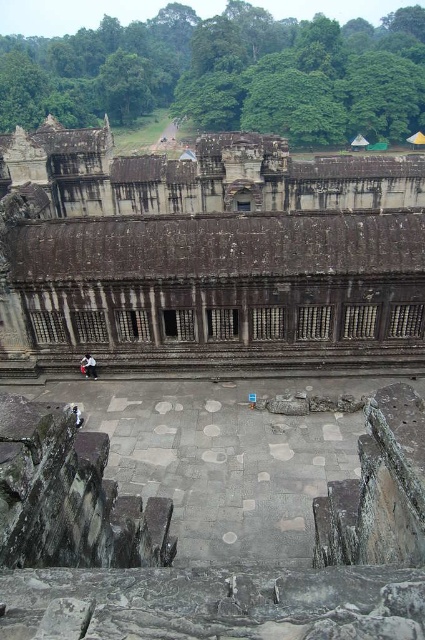
Based on the scene description, where exactly is the weathered stone ruins at center located in the image?

The weathered stone ruins at center is located at point (x=212, y=253) in the image.

You are standing at the edge of the temple courtyard and notice both the weathered stone ruins at center and the white cotton shirt at center. Which object is closer to you?

The weathered stone ruins at center is closer to you because it is in front of the white cotton shirt at center.